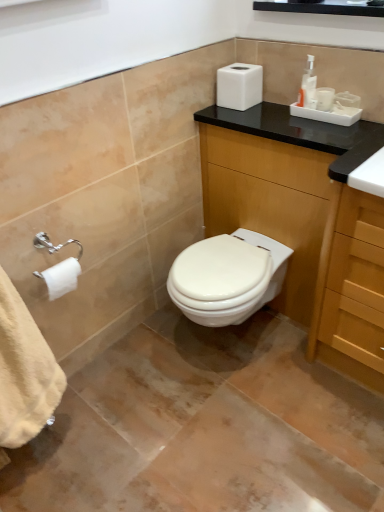
Locate an element on the screen. The width and height of the screenshot is (384, 512). white matte toilet paper at left is located at coordinates (61, 277).

In order to face white matte toilet paper at left, should I rotate leftwards or rightwards?

To face it directly, rotate left by 17.076 degrees.

Locate an element on the screen. This screenshot has height=512, width=384. white matte toilet paper at left is located at coordinates (61, 277).

Which object is positioned more to the left, wooden cabinet at center or white matte toilet paper at left?

From the viewer's perspective, white matte toilet paper at left appears more on the left side.

Between wooden cabinet at center and white matte toilet paper at left, which one has less height?

white matte toilet paper at left.

Is wooden cabinet at center bigger than white matte toilet paper at left?

Yes.

How many degrees apart are the facing directions of white matte toilet paper at left and translucent plastic pump bottle at upper right?

89.7 degrees separate the facing orientations of white matte toilet paper at left and translucent plastic pump bottle at upper right.

Is white matte toilet paper at left taller than translucent plastic pump bottle at upper right?

Incorrect, the height of white matte toilet paper at left is not larger of that of translucent plastic pump bottle at upper right.

From the picture: Which of these two, white matte toilet paper at left or translucent plastic pump bottle at upper right, is wider?

translucent plastic pump bottle at upper right is wider.

Do you think white matte toilet paper at left is within translucent plastic pump bottle at upper right, or outside of it?

The correct answer is: outside.

Does black glossy medicine cabinet at upper center have a greater height compared to wooden cabinet at center?

In fact, black glossy medicine cabinet at upper center may be shorter than wooden cabinet at center.

From the image's perspective, which one is positioned higher, black glossy medicine cabinet at upper center or wooden cabinet at center?

black glossy medicine cabinet at upper center.

From a real-world perspective, is black glossy medicine cabinet at upper center positioned over wooden cabinet at center based on gravity?

Correct, in the physical world, black glossy medicine cabinet at upper center is higher than wooden cabinet at center.

Is black glossy medicine cabinet at upper center looking in the opposite direction of wooden cabinet at center?

black glossy medicine cabinet at upper center does not have its back to wooden cabinet at center.

From a real-world perspective, who is located lower, wooden cabinet at center or translucent plastic pump bottle at upper right?

wooden cabinet at center.

From the image's perspective, which one is positioned lower, wooden cabinet at center or translucent plastic pump bottle at upper right?

wooden cabinet at center appears lower in the image.

Is the depth of wooden cabinet at center less than that of translucent plastic pump bottle at upper right?

Yes, wooden cabinet at center is closer to the viewer.

Which is more to the left, translucent plastic pump bottle at upper right or wooden cabinet at center?

wooden cabinet at center is more to the left.

Find the location of a particular element. This screenshot has height=512, width=384. toiletry above the wooden cabinet at center (from a real-world perspective) is located at coordinates (307, 84).

Is translucent plastic pump bottle at upper right taller than wooden cabinet at center?

In fact, translucent plastic pump bottle at upper right may be shorter than wooden cabinet at center.

From the image's perspective, does translucent plastic pump bottle at upper right appear higher than white matte toilet paper at left?

Yes, from the image's perspective, translucent plastic pump bottle at upper right is on top of white matte toilet paper at left.

Which is less distant, (309, 62) or (54, 270)?

The point (54, 270) is closer.

From a real-world perspective, which object stands above the other?

translucent plastic pump bottle at upper right.

Can you confirm if translucent plastic pump bottle at upper right is smaller than white matte toilet paper at left?

Yes.

How many degrees apart are the facing directions of black glossy medicine cabinet at upper center and white matte toilet paper at left?

The angular difference between black glossy medicine cabinet at upper center and white matte toilet paper at left is 89.8 degrees.

Based on their positions, is black glossy medicine cabinet at upper center located to the left or right of white matte toilet paper at left?

Clearly, black glossy medicine cabinet at upper center is on the right of white matte toilet paper at left in the image.

Is black glossy medicine cabinet at upper center looking in the opposite direction of white matte toilet paper at left?

No, black glossy medicine cabinet at upper center is not facing the opposite direction of white matte toilet paper at left.

How distant is black glossy medicine cabinet at upper center from white matte toilet paper at left?

They are 4.25 feet apart.

In the image, there is a wooden cabinet at center. Where is `toilet paper below it (from the image's perspective)`? The image size is (384, 512). toilet paper below it (from the image's perspective) is located at coordinates (61, 277).

This screenshot has width=384, height=512. What are the coordinates of `toiletry that is above the white matte toilet paper at left (from a real-world perspective)` in the screenshot? It's located at (307, 84).

Estimate the real-world distances between objects in this image. Which object is further from translucent plastic pump bottle at upper right, white matte toilet paper at left or wooden cabinet at center?

white matte toilet paper at left is positioned further to the anchor translucent plastic pump bottle at upper right.

Considering their positions, is black glossy medicine cabinet at upper center positioned further to white matte toilet paper at left than translucent plastic pump bottle at upper right?

Based on the image, black glossy medicine cabinet at upper center appears to be further to white matte toilet paper at left.

Estimate the real-world distances between objects in this image. Which object is further from wooden cabinet at center, translucent plastic pump bottle at upper right or white matte toilet paper at left?

The object further to wooden cabinet at center is white matte toilet paper at left.

Considering their positions, is translucent plastic pump bottle at upper right positioned closer to black glossy medicine cabinet at upper center than white matte toilet paper at left?

Among the two, translucent plastic pump bottle at upper right is located nearer to black glossy medicine cabinet at upper center.

Looking at the image, which one is located closer to black glossy medicine cabinet at upper center, wooden cabinet at center or translucent plastic pump bottle at upper right?

translucent plastic pump bottle at upper right.

From the picture: When comparing their distances from black glossy medicine cabinet at upper center, does white matte toilet paper at left or wooden cabinet at center seem closer?

wooden cabinet at center is positioned closer to the anchor black glossy medicine cabinet at upper center.

Looking at the image, which one is located closer to white matte toilet paper at left, translucent plastic pump bottle at upper right or wooden cabinet at center?

wooden cabinet at center.

Looking at the image, which one is located further to white matte toilet paper at left, wooden cabinet at center or black glossy medicine cabinet at upper center?

black glossy medicine cabinet at upper center lies further to white matte toilet paper at left than the other object.

Where is `toiletry that lies between black glossy medicine cabinet at upper center and wooden cabinet at center from top to bottom`? Image resolution: width=384 pixels, height=512 pixels. toiletry that lies between black glossy medicine cabinet at upper center and wooden cabinet at center from top to bottom is located at coordinates (307, 84).

Find the location of `bathroom cabinet between white matte toilet paper at left and translucent plastic pump bottle at upper right in the horizontal direction`. bathroom cabinet between white matte toilet paper at left and translucent plastic pump bottle at upper right in the horizontal direction is located at coordinates (286, 200).

At what (x,y) coordinates should I click in order to perform the action: click on bathroom cabinet between black glossy medicine cabinet at upper center and white matte toilet paper at left vertically. Please return your answer as a coordinate pair (x, y). This screenshot has height=512, width=384. Looking at the image, I should click on (286, 200).

At what (x,y) coordinates should I click in order to perform the action: click on toiletry between white matte toilet paper at left and black glossy medicine cabinet at upper center in the horizontal direction. Please return your answer as a coordinate pair (x, y). Looking at the image, I should click on (307, 84).